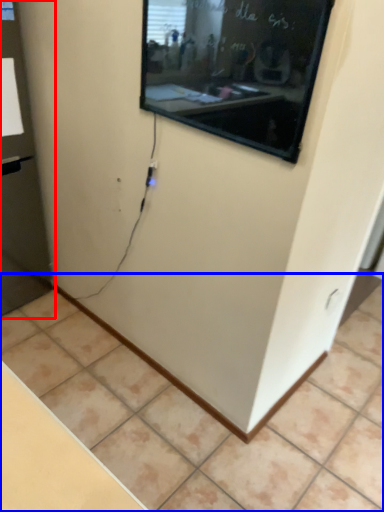
Question: Which object is further to the camera taking this photo, glass door (highlighted by a red box) or tile (highlighted by a blue box)?

Choices:
 (A) glass door
 (B) tile

Answer: (A)